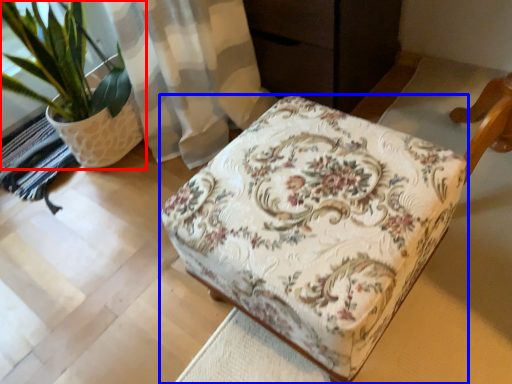
Question: Which object appears closest to the camera in this image, houseplant (highlighted by a red box) or furniture (highlighted by a blue box)?

Choices:
 (A) houseplant
 (B) furniture

Answer: (B)